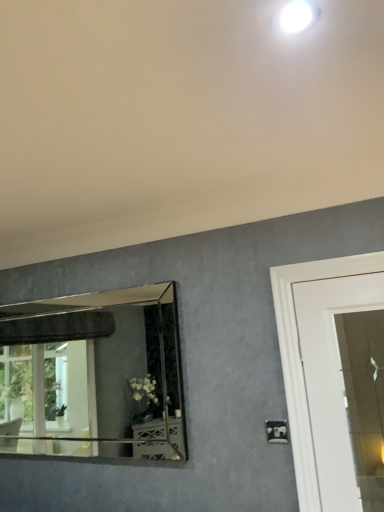
Question: Can you confirm if silver-framed mirror at left is taller than white plastic light switch at lower right?

Choices:
 (A) no
 (B) yes

Answer: (B)

Question: Is white plastic light switch at lower right completely or partially inside silver-framed mirror at left?

Choices:
 (A) no
 (B) yes

Answer: (A)

Question: Does silver-framed mirror at left turn towards white plastic light switch at lower right?

Choices:
 (A) no
 (B) yes

Answer: (A)

Question: Are silver-framed mirror at left and white plastic light switch at lower right located far from each other?

Choices:
 (A) no
 (B) yes

Answer: (B)

Question: From a real-world perspective, is silver-framed mirror at left over white plastic light switch at lower right?

Choices:
 (A) yes
 (B) no

Answer: (A)

Question: Is silver-framed mirror at left shorter than white plastic light switch at lower right?

Choices:
 (A) yes
 (B) no

Answer: (B)

Question: Is white glossy droplight at upper center looking in the opposite direction of white plastic light switch at lower right?

Choices:
 (A) no
 (B) yes

Answer: (A)

Question: From a real-world perspective, is white glossy droplight at upper center physically above white plastic light switch at lower right?

Choices:
 (A) yes
 (B) no

Answer: (A)

Question: Is white glossy droplight at upper center aimed at white plastic light switch at lower right?

Choices:
 (A) yes
 (B) no

Answer: (B)

Question: From a real-world perspective, is white glossy droplight at upper center under white plastic light switch at lower right?

Choices:
 (A) no
 (B) yes

Answer: (A)

Question: Can you confirm if white glossy droplight at upper center is smaller than white plastic light switch at lower right?

Choices:
 (A) no
 (B) yes

Answer: (B)

Question: From the image's perspective, is white glossy droplight at upper center beneath white plastic light switch at lower right?

Choices:
 (A) no
 (B) yes

Answer: (A)

Question: Does white plastic light switch at lower right turn towards white glossy droplight at upper center?

Choices:
 (A) no
 (B) yes

Answer: (A)